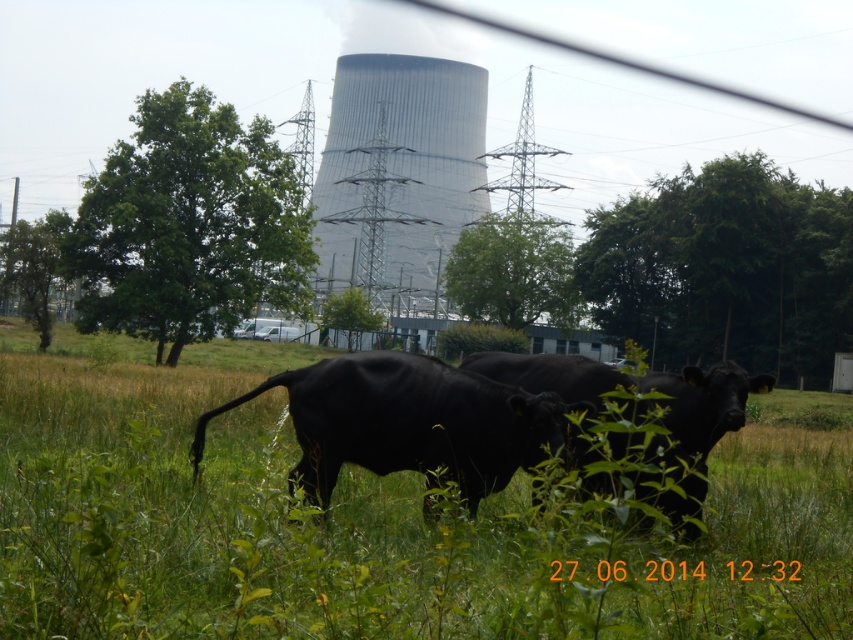
At what (x,y) coordinates should I click in order to perform the action: click on black matte cow at center. Please return your answer as a coordinate pair (x, y). This screenshot has width=853, height=640. Looking at the image, I should click on (372, 522).

Does black matte cow at center have a smaller size compared to black glossy bull at center?

No.

Does point (775, 534) come behind point (538, 420)?

Yes.

I want to click on black matte cow at center, so click(372, 522).

Can you confirm if black matte cow at center is positioned below smooth concrete tower at center?

Yes.

Can you confirm if black matte cow at center is taller than smooth concrete tower at center?

Answer: In fact, black matte cow at center may be shorter than smooth concrete tower at center.

You are a GUI agent. You are given a task and a screenshot of the screen. Output one action in this format:
    pyautogui.click(x=<x>, y=<y>)
    Task: Click on the black matte cow at center
    The height and width of the screenshot is (640, 853).
    Given the screenshot: What is the action you would take?
    pyautogui.click(x=372, y=522)

Who is positioned more to the left, smooth concrete tower at center or black glossy bull at center?

smooth concrete tower at center

Does point (421, 268) lie behind point (399, 429)?

Yes, it is.

Describe the element at coordinates (398, 172) in the screenshot. Image resolution: width=853 pixels, height=640 pixels. I see `smooth concrete tower at center` at that location.

This screenshot has height=640, width=853. In order to click on smooth concrete tower at center in this screenshot , I will do `click(398, 172)`.